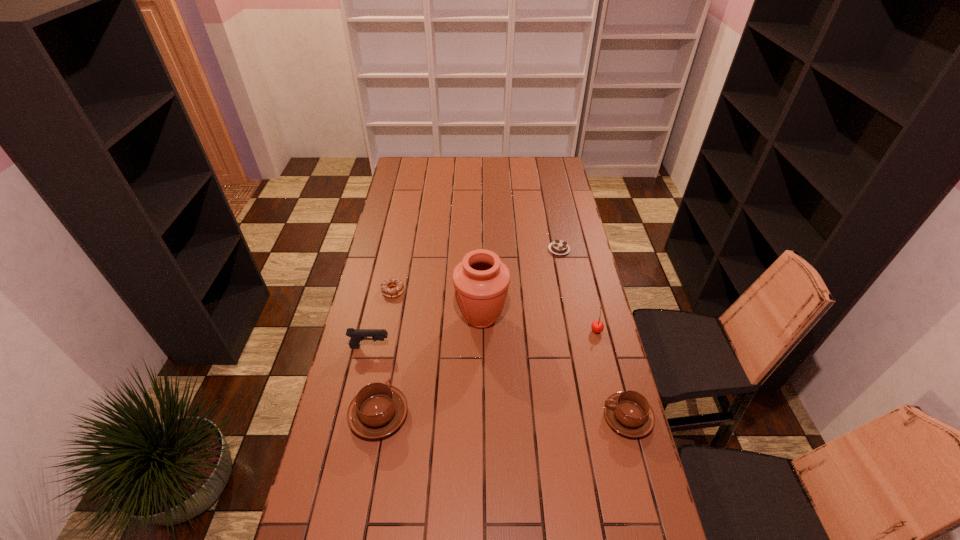
At what (x,y) coordinates should I click in order to perform the action: click on free space located on the left of the sixth tallest object. Please return your answer as a coordinate pair (x, y). The width and height of the screenshot is (960, 540). Looking at the image, I should click on (366, 291).

Locate an element on the screen. The width and height of the screenshot is (960, 540). cappuccino located in the left edge section of the desktop is located at coordinates (378, 409).

Find the location of a particular element. Image resolution: width=960 pixels, height=540 pixels. pistol that is at the left edge is located at coordinates (356, 335).

The image size is (960, 540). What are the coordinates of `doughnut at the left edge` in the screenshot? It's located at (396, 282).

This screenshot has height=540, width=960. Identify the location of cappuccino that is at the right edge. point(629,413).

Find the location of `chocolate cake located in the right edge section of the desktop`. chocolate cake located in the right edge section of the desktop is located at coordinates (558, 247).

You are a GUI agent. You are given a task and a screenshot of the screen. Output one action in this format:
    pyautogui.click(x=<x>, y=<y>)
    Task: Click on the cherry present at the right edge
    This screenshot has height=540, width=960.
    Given the screenshot: What is the action you would take?
    pyautogui.click(x=597, y=326)

This screenshot has width=960, height=540. Identify the location of free space at the far edge of the desktop. (504, 172).

The image size is (960, 540). In the image, there is a desktop. In order to click on free space at the left edge in this screenshot , I will do `click(373, 471)`.

At what (x,y) coordinates should I click in order to perform the action: click on vacant space at the right edge. Please return your answer as a coordinate pair (x, y). This screenshot has height=540, width=960. Looking at the image, I should click on (565, 314).